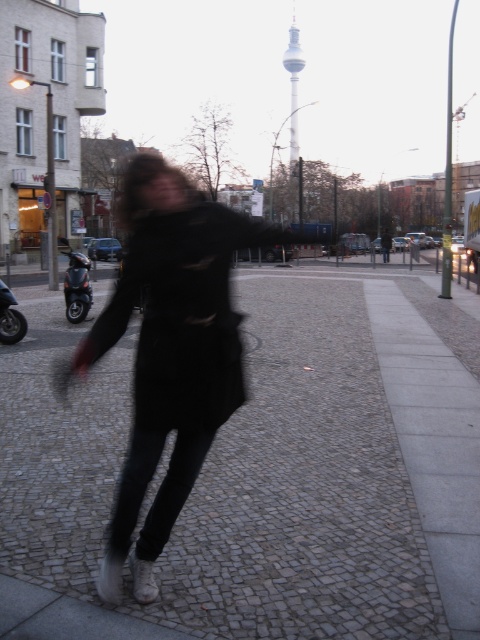
Question: Can you confirm if cobblestone pavement at center is wider than brushed metal scooter at left?

Choices:
 (A) yes
 (B) no

Answer: (A)

Question: Considering the real-world distances, which object is closest to the black matte motorcycle at left?

Choices:
 (A) ripped black coat at center
 (B) brushed metal scooter at left

Answer: (B)

Question: Which is nearer to the brushed metal scooter at left?

Choices:
 (A) cobblestone pavement at center
 (B) ripped black coat at center
 (C) black matte motorcycle at left

Answer: (C)

Question: Which of the following is the farthest from the observer?

Choices:
 (A) coord(343,298)
 (B) coord(158,218)
 (C) coord(2,282)

Answer: (C)

Question: Does brushed metal scooter at left appear over black matte motorcycle at left?

Choices:
 (A) yes
 (B) no

Answer: (A)

Question: Is cobblestone pavement at center wider than ripped black coat at center?

Choices:
 (A) no
 (B) yes

Answer: (B)